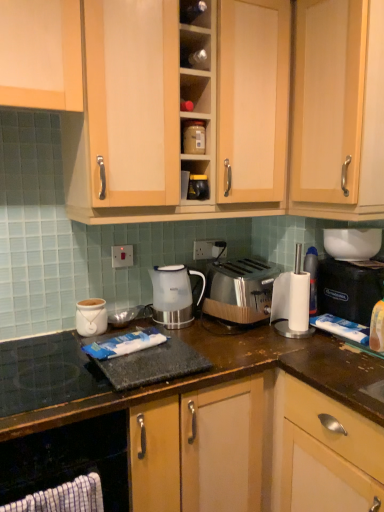
Image resolution: width=384 pixels, height=512 pixels. In order to click on free space above black glass gas stove at lower left (from a real-world perspective) in this screenshot , I will do [54, 360].